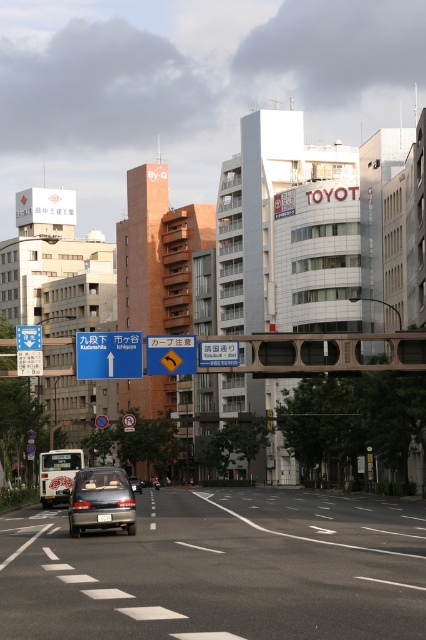
Question: Does blue plastic sign at upper center appear on the left side of matte silver sedan at center?

Choices:
 (A) no
 (B) yes

Answer: (A)

Question: Is metallic gray bridge at center further to the viewer compared to matte gray car at center?

Choices:
 (A) no
 (B) yes

Answer: (B)

Question: Which of the following is the closest to the observer?

Choices:
 (A) yellow reflective text at center
 (B) matte silver sedan at center
 (C) metallic gray bridge at center
 (D) yellow plastic traffic sign at center

Answer: (B)

Question: Estimate the real-world distances between objects in this image. Which object is closer to the yellow plastic traffic sign at center?

Choices:
 (A) blue plastic sign at upper center
 (B) metallic gray bridge at center
 (C) matte silver sedan at center

Answer: (A)

Question: Is matte gray car at center to the left of yellow reflective text at center from the viewer's perspective?

Choices:
 (A) yes
 (B) no

Answer: (A)

Question: Which object is farther from the camera taking this photo?

Choices:
 (A) yellow plastic traffic sign at center
 (B) matte gray car at center
 (C) matte silver sedan at center
 (D) blue plastic sign at upper center

Answer: (A)